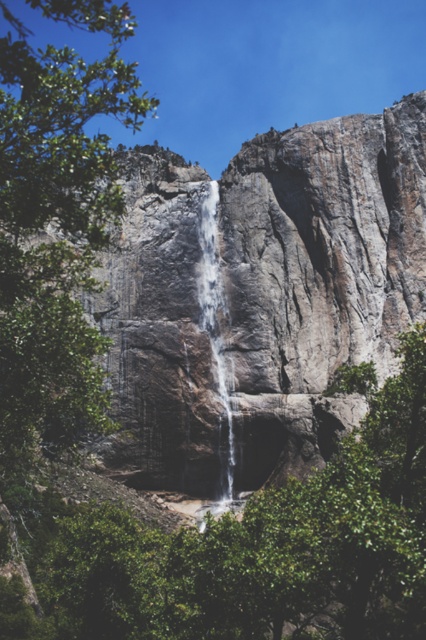
Question: Among these objects, which one is nearest to the camera?

Choices:
 (A) clear water at center
 (B) green leafy tree at center

Answer: (B)

Question: Does green leafy tree at center appear under clear water at center?

Choices:
 (A) no
 (B) yes

Answer: (B)

Question: Is green leafy tree at center smaller than clear water at center?

Choices:
 (A) yes
 (B) no

Answer: (B)

Question: In this image, where is green leafy tree at center located relative to clear water at center?

Choices:
 (A) above
 (B) below

Answer: (B)

Question: Among these points, which one is farthest from the camera?

Choices:
 (A) (282, 605)
 (B) (230, 390)

Answer: (B)

Question: Among these objects, which one is nearest to the camera?

Choices:
 (A) green leafy tree at center
 (B) clear water at center

Answer: (A)